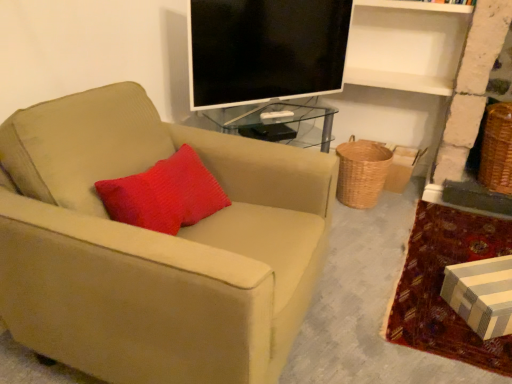
Where is `free area in between woven brown basket at lower right, placed as the 2th basket when sorted from right to left, and striped cardboard box at lower right`? free area in between woven brown basket at lower right, placed as the 2th basket when sorted from right to left, and striped cardboard box at lower right is located at coordinates (364, 236).